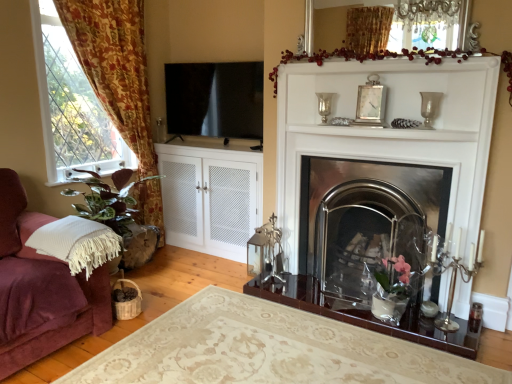
Describe the element at coordinates (324, 106) in the screenshot. The width and height of the screenshot is (512, 384). I see `clear glass vase at upper center, which is the first candle holder in left-to-right order` at that location.

Describe the element at coordinates (215, 99) in the screenshot. I see `transparent glass window screen at upper left` at that location.

Identify the location of transparent glass window screen at upper left. (215, 99).

Image resolution: width=512 pixels, height=384 pixels. I want to click on white mesh cabinet at center, so click(x=210, y=196).

Where is `clear glass vase at upper center, the first candle holder viewed from the top`? clear glass vase at upper center, the first candle holder viewed from the top is located at coordinates (324, 106).

From the image's perspective, who appears lower, clear glass vase at upper right, placed as the 2th candle holder when sorted from right to left, or polished stainless steel fireplace at center?

polished stainless steel fireplace at center.

Which object is thinner, clear glass vase at upper right, placed as the 2th candle holder when sorted from right to left, or polished stainless steel fireplace at center?

Thinner between the two is clear glass vase at upper right, placed as the 2th candle holder when sorted from right to left.

Considering the relative sizes of clear glass vase at upper right, the 2th candle holder from the bottom, and polished stainless steel fireplace at center in the image provided, is clear glass vase at upper right, the 2th candle holder from the bottom, taller than polished stainless steel fireplace at center?

No, clear glass vase at upper right, the 2th candle holder from the bottom, is not taller than polished stainless steel fireplace at center.

From the image's perspective, count 1st candle holders upward from the polished stainless steel fireplace at center and point to it. Please provide its 2D coordinates.

[(429, 107)]

From the image's perspective, which one is positioned lower, transparent glass window screen at upper left or silver metallic clock at upper center?

From the image's view, silver metallic clock at upper center is below.

Could you tell me if transparent glass window screen at upper left is facing silver metallic clock at upper center?

No, transparent glass window screen at upper left does not turn towards silver metallic clock at upper center.

Measure the distance between transparent glass window screen at upper left and silver metallic clock at upper center.

They are 4.53 feet apart.

Which of these two, silver metallic clock at upper center or white glossy mantle at center, is thinner?

Thinner between the two is silver metallic clock at upper center.

Is the position of silver metallic clock at upper center less distant than that of white glossy mantle at center?

No, it is behind white glossy mantle at center.

Which is nearer, (378, 107) or (335, 132)?

The point (378, 107) is in front.

Is silver metallic candle holder at right, the first candle holder from the bottom, far away from white mesh cabinet at center?

Absolutely, silver metallic candle holder at right, the first candle holder from the bottom, is distant from white mesh cabinet at center.

Is point (455, 265) in front of point (158, 149)?

Yes, it is.

How much distance is there between silver metallic candle holder at right, which is counted as the third candle holder, starting from the top, and white mesh cabinet at center?

A distance of 1.83 meters exists between silver metallic candle holder at right, which is counted as the third candle holder, starting from the top, and white mesh cabinet at center.

Based on the photo, from a real-world perspective, does floral fabric curtain at left stand above clear glass vase at upper right, which is counted as the 2th candle holder, starting from the top?

Actually, floral fabric curtain at left is physically below clear glass vase at upper right, which is counted as the 2th candle holder, starting from the top, in the real world.

Is clear glass vase at upper right, the 2th candle holder from the bottom, completely or partially inside floral fabric curtain at left?

No, clear glass vase at upper right, the 2th candle holder from the bottom, is not a part of floral fabric curtain at left.

Is floral fabric curtain at left to the right of clear glass vase at upper right, which is the second candle holder in left-to-right order, from the viewer's perspective?

No, floral fabric curtain at left is not to the right of clear glass vase at upper right, which is the second candle holder in left-to-right order.

Between floral fabric curtain at left and clear glass vase at upper right, which is counted as the 2th candle holder, starting from the top, which one has more height?

floral fabric curtain at left is taller.

Considering the sizes of silver metallic candle holder at right, which is counted as the third candle holder, starting from the top, and polished stainless steel fireplace at center in the image, is silver metallic candle holder at right, which is counted as the third candle holder, starting from the top, wider or thinner than polished stainless steel fireplace at center?

silver metallic candle holder at right, which is counted as the third candle holder, starting from the top, is thinner than polished stainless steel fireplace at center.

Who is taller, silver metallic candle holder at right, the third candle holder viewed from the left, or polished stainless steel fireplace at center?

polished stainless steel fireplace at center.

Is silver metallic candle holder at right, the 1th candle holder when ordered from right to left, oriented away from polished stainless steel fireplace at center?

No, silver metallic candle holder at right, the 1th candle holder when ordered from right to left,'s orientation is not away from polished stainless steel fireplace at center.

Considering the sizes of objects silver metallic candle holder at right, the third candle holder viewed from the left, and polished stainless steel fireplace at center in the image provided, who is bigger, silver metallic candle holder at right, the third candle holder viewed from the left, or polished stainless steel fireplace at center?

polished stainless steel fireplace at center is bigger.

Where is `plant below the clear glass vase at upper center, the second plant from the bottom (from the image's perspective)`? plant below the clear glass vase at upper center, the second plant from the bottom (from the image's perspective) is located at coordinates (118, 213).

Is point (89, 218) behind point (356, 60)?

No, (89, 218) is in front of (356, 60).

From a real-world perspective, is green leafy plant at left, placed as the first plant when sorted from left to right, above or below clear glass vase at upper center, the second plant from the bottom?

From a real-world perspective, green leafy plant at left, placed as the first plant when sorted from left to right, is physically below clear glass vase at upper center, the second plant from the bottom.

This screenshot has width=512, height=384. I want to click on fireplace that is below the clear glass vase at upper right, which is counted as the 2th candle holder, starting from the top (from the image's perspective), so (373, 179).

Locate an element on the screen. picture frame positioned vertically above the transparent glass window screen at upper left (from a real-world perspective) is located at coordinates (371, 103).

Based on their spatial positions, is silver metallic clock at upper center or silver metallic candle holder at right, the first candle holder from the bottom, closer to white glossy mantle at center?

silver metallic clock at upper center.

Which object lies nearer to the anchor point white glossy mantle at center, silver metallic clock at upper center or clear glass vase at upper center, which is counted as the third candle holder, starting from the right?

Among the two, silver metallic clock at upper center is located nearer to white glossy mantle at center.

Consider the image. Based on their spatial positions, is green leafy plant at left, positioned as the 1th plant in bottom-to-top order, or polished stainless steel fireplace at center closer to white mesh cabinet at center?

green leafy plant at left, positioned as the 1th plant in bottom-to-top order.

When comparing their distances from silver metallic candle holder at right, the 1th candle holder when ordered from right to left, does clear glass vase at upper center, the third candle holder positioned from the bottom, or transparent glass window screen at upper left seem closer?

Based on the image, clear glass vase at upper center, the third candle holder positioned from the bottom, appears to be nearer to silver metallic candle holder at right, the 1th candle holder when ordered from right to left.

Looking at the image, which one is located closer to polished stainless steel fireplace at center, clear glass vase at upper center, which is the first candle holder in left-to-right order, or white glossy mantle at center?

white glossy mantle at center.

When comparing their distances from clear glass vase at upper center, the 2th plant from the left, does polished stainless steel fireplace at center or clear glass vase at upper center, the first candle holder viewed from the top, seem further?

polished stainless steel fireplace at center is positioned further to the anchor clear glass vase at upper center, the 2th plant from the left.

Considering their positions, is transparent glass window screen at upper left positioned further to clear glass vase at upper right, which is the second candle holder in left-to-right order, than clear glass vase at upper center, which is counted as the 1th plant, starting from the top?

Based on the image, transparent glass window screen at upper left appears to be further to clear glass vase at upper right, which is the second candle holder in left-to-right order.

Based on their spatial positions, is green leafy plant at left, positioned as the 1th plant in bottom-to-top order, or white glossy mantle at center further from clear glass vase at upper right, which is counted as the 2th candle holder, starting from the top?

green leafy plant at left, positioned as the 1th plant in bottom-to-top order, is further to clear glass vase at upper right, which is counted as the 2th candle holder, starting from the top.

Where is `window screen between floral fabric curtain at left and clear glass vase at upper center, the 2th plant from the left, from left to right`? window screen between floral fabric curtain at left and clear glass vase at upper center, the 2th plant from the left, from left to right is located at coordinates (215, 99).

Locate an element on the screen. This screenshot has width=512, height=384. mantle situated between floral fabric curtain at left and clear glass vase at upper right, which is counted as the 2th candle holder, starting from the top, from left to right is located at coordinates (386, 133).

Find the location of `candle holder located between floral fabric curtain at left and white glossy mantle at center in the left-right direction`. candle holder located between floral fabric curtain at left and white glossy mantle at center in the left-right direction is located at coordinates (324, 106).

Locate an element on the screen. The height and width of the screenshot is (384, 512). picture frame positioned between white glossy mantle at center and clear glass vase at upper center, which is counted as the third candle holder, starting from the right, from near to far is located at coordinates (371, 103).